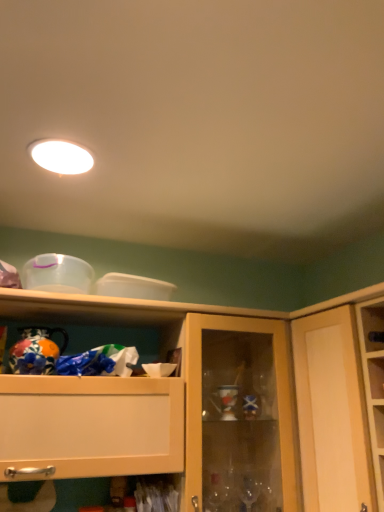
Question: Does matte wood cupboard at right have a lesser width compared to hand-painted ceramic vase at left?

Choices:
 (A) yes
 (B) no

Answer: (B)

Question: Is matte wood cupboard at right turned away from hand-painted ceramic vase at left?

Choices:
 (A) yes
 (B) no

Answer: (B)

Question: From a real-world perspective, does matte wood cupboard at right sit lower than hand-painted ceramic vase at left?

Choices:
 (A) yes
 (B) no

Answer: (A)

Question: Can you confirm if matte wood cupboard at right is wider than hand-painted ceramic vase at left?

Choices:
 (A) yes
 (B) no

Answer: (A)

Question: Considering the relative positions of matte wood cupboard at right and hand-painted ceramic vase at left in the image provided, is matte wood cupboard at right behind hand-painted ceramic vase at left?

Choices:
 (A) no
 (B) yes

Answer: (A)

Question: From the image's perspective, does matte wood cupboard at right appear lower than hand-painted ceramic vase at left?

Choices:
 (A) yes
 (B) no

Answer: (A)

Question: From a real-world perspective, is matte wood cupboard at right positioned over wooden cabinet at upper center based on gravity?

Choices:
 (A) yes
 (B) no

Answer: (A)

Question: Is wooden cabinet at upper center surrounded by matte wood cupboard at right?

Choices:
 (A) no
 (B) yes

Answer: (A)

Question: From a real-world perspective, is matte wood cupboard at right under wooden cabinet at upper center?

Choices:
 (A) yes
 (B) no

Answer: (B)

Question: Is matte wood cupboard at right positioned in front of wooden cabinet at upper center?

Choices:
 (A) no
 (B) yes

Answer: (B)

Question: Is matte wood cupboard at right not inside wooden cabinet at upper center?

Choices:
 (A) yes
 (B) no

Answer: (A)

Question: Does matte wood cupboard at right appear on the right side of wooden cabinet at upper center?

Choices:
 (A) yes
 (B) no

Answer: (A)

Question: Is wooden cabinet at upper center at the left side of hand-painted ceramic vase at left?

Choices:
 (A) yes
 (B) no

Answer: (B)